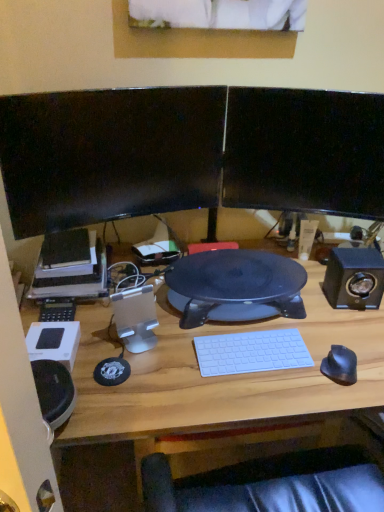
Where is `free space above wooden desk at center (from a real-world perspective)`? The width and height of the screenshot is (384, 512). free space above wooden desk at center (from a real-world perspective) is located at coordinates (x=273, y=316).